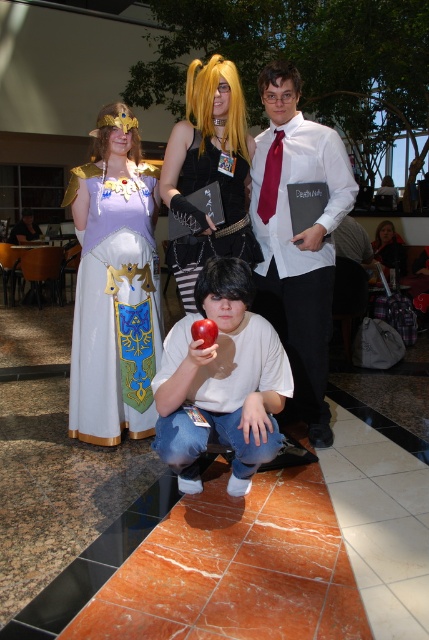
Question: Which object appears closest to the camera in this image?

Choices:
 (A) shiny black book at center
 (B) red matte apple at center
 (C) white matte shirt at center

Answer: (B)

Question: Which object is the closest to the lavender satin dress at upper left?

Choices:
 (A) white matte shirt at center
 (B) shiny black book at center
 (C) white shirt at center
 (D) red matte apple at center

Answer: (B)

Question: Which point appears farthest from the camera in this image?

Choices:
 (A) (193, 330)
 (B) (78, 360)
 (C) (195, 116)

Answer: (C)

Question: Is white shirt at center wider than shiny black book at center?

Choices:
 (A) yes
 (B) no

Answer: (A)

Question: Where is lavender satin dress at upper left located in relation to red matte apple at center in the image?

Choices:
 (A) left
 (B) right

Answer: (A)

Question: Does white matte shirt at center have a greater width compared to shiny black book at center?

Choices:
 (A) yes
 (B) no

Answer: (A)